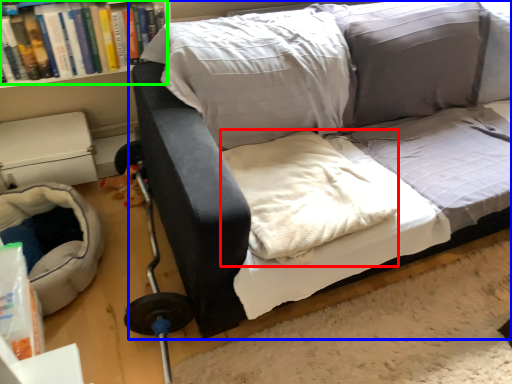
Question: Which is farther away from linen (highlighted by a red box)? studio couch (highlighted by a blue box) or book (highlighted by a green box)?

Choices:
 (A) studio couch
 (B) book

Answer: (B)